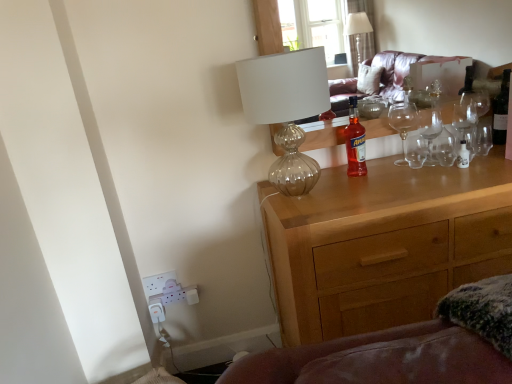
Question: From the image's perspective, does dark glass wine bottle at upper right appear higher than translucent glass lamp at upper center?

Choices:
 (A) yes
 (B) no

Answer: (A)

Question: Is dark glass wine bottle at upper right to the right of translucent glass lamp at upper center from the viewer's perspective?

Choices:
 (A) no
 (B) yes

Answer: (B)

Question: Does dark glass wine bottle at upper right have a lesser width compared to translucent glass lamp at upper center?

Choices:
 (A) no
 (B) yes

Answer: (B)

Question: Is dark glass wine bottle at upper right to the left of translucent glass lamp at upper center from the viewer's perspective?

Choices:
 (A) no
 (B) yes

Answer: (A)

Question: Is dark glass wine bottle at upper right aimed at translucent glass lamp at upper center?

Choices:
 (A) yes
 (B) no

Answer: (B)

Question: Considering the relative sizes of dark glass wine bottle at upper right and translucent glass lamp at upper center in the image provided, is dark glass wine bottle at upper right bigger than translucent glass lamp at upper center?

Choices:
 (A) no
 (B) yes

Answer: (A)

Question: Is wooden chest of drawers at center oriented away from dark glass wine bottle at upper right?

Choices:
 (A) yes
 (B) no

Answer: (B)

Question: Is wooden chest of drawers at center next to dark glass wine bottle at upper right?

Choices:
 (A) yes
 (B) no

Answer: (B)

Question: From the image's perspective, is wooden chest of drawers at center located above dark glass wine bottle at upper right?

Choices:
 (A) no
 (B) yes

Answer: (A)

Question: Is wooden chest of drawers at center not within dark glass wine bottle at upper right?

Choices:
 (A) yes
 (B) no

Answer: (A)

Question: Is wooden chest of drawers at center further to camera compared to dark glass wine bottle at upper right?

Choices:
 (A) no
 (B) yes

Answer: (A)

Question: Is wooden chest of drawers at center at the left side of dark glass wine bottle at upper right?

Choices:
 (A) yes
 (B) no

Answer: (A)

Question: Is the surface of translucent glass bottle at center in direct contact with wooden chest of drawers at center?

Choices:
 (A) yes
 (B) no

Answer: (B)